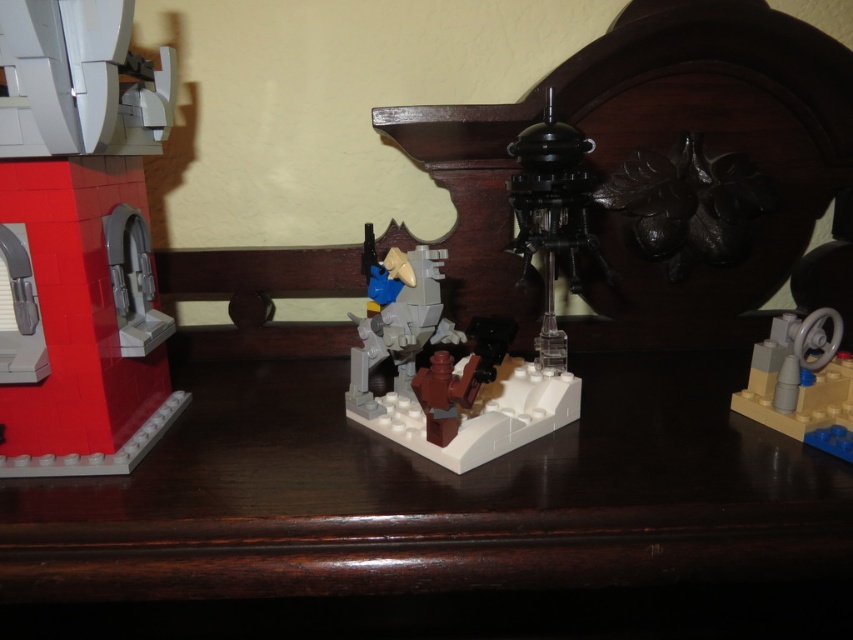
You are trying to decide where to place a new LEGO piece that is 10 cm wide. The dark wood table at center and the smooth white tower at left are both options. Which surface can definitely accommodate the piece without overhanging?

The dark wood table at center is wider than the smooth white tower at left, so the dark wood table at center can definitely accommodate the 10 cm wide LEGO piece without overhanging.

You are trying to place a small LEGO baseplate on the dark wood table at center without it falling off. Is the smooth white tower at left in the way of placing it?

The dark wood table at center is positioned under the smooth white tower at left, so placing the baseplate might be obstructed by the tower. Ensure there is enough space between them before placing it.